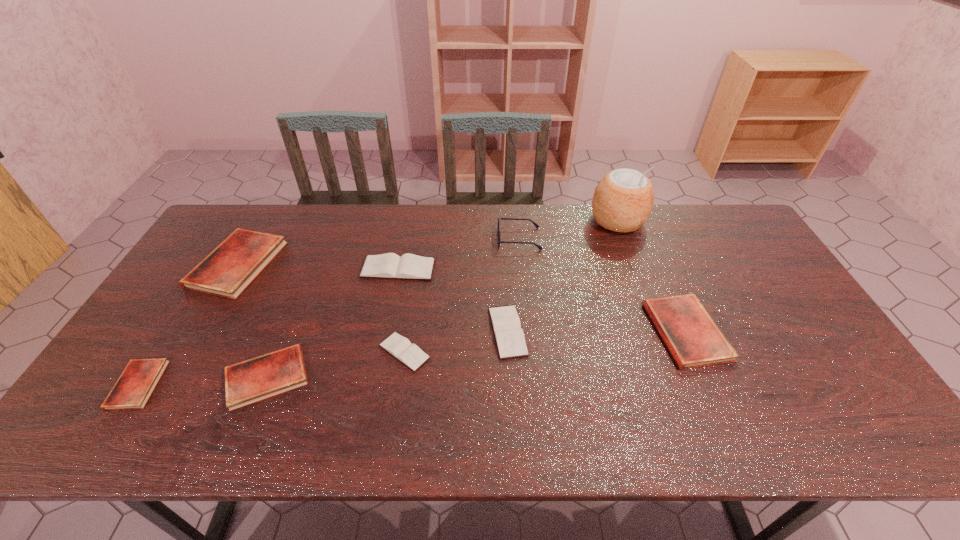
At what (x,y) coordinates should I click in order to perform the action: click on red diary identified as the second closest to the biggest brown diary. Please return your answer as a coordinate pair (x, y). This screenshot has width=960, height=540. Looking at the image, I should click on click(x=230, y=268).

This screenshot has width=960, height=540. Find the location of `brown diary that is the closest to the seventh object from right to left`. brown diary that is the closest to the seventh object from right to left is located at coordinates (411, 355).

Choose which brown diary is the second nearest neighbor to the biggest brown diary. Please provide its 2D coordinates. Your answer should be formatted as a tuple, i.e. [(x, y)], where the tuple contains the x and y coordinates of a point satisfying the conditions above.

[(411, 355)]

Find the location of a particular element. The height and width of the screenshot is (540, 960). free space that satisfies the following two spatial constraints: 1. on the back side of the rightmost brown diary; 2. on the left side of the smallest red diary is located at coordinates (172, 332).

Find the location of a particular element. Image resolution: width=960 pixels, height=540 pixels. free location that satisfies the following two spatial constraints: 1. on the front-facing side of the rightmost red diary; 2. on the left side of the spectacles is located at coordinates (529, 332).